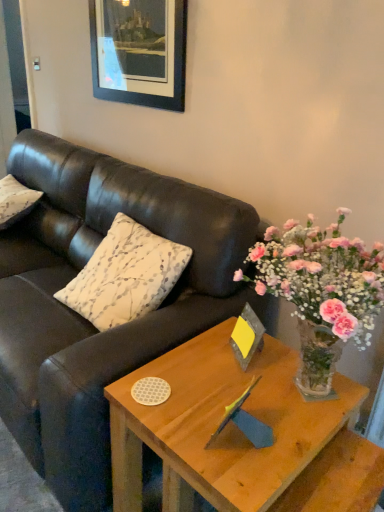
Identify the location of white printed cushion at upper left, which is counted as the first pillow, starting from the front. The width and height of the screenshot is (384, 512). (125, 275).

This screenshot has height=512, width=384. What are the coordinates of `white textured pillow at left, the 2th pillow from the right` in the screenshot? It's located at (15, 201).

What do you see at coordinates (139, 52) in the screenshot? I see `wooden picture frame at upper center, which appears as the second picture frame when ordered from the bottom` at bounding box center [139, 52].

Where is `white printed cushion at upper left, the 1th pillow viewed from the right`? white printed cushion at upper left, the 1th pillow viewed from the right is located at coordinates (125, 275).

Is white printed cushion at upper left, the 2th pillow positioned from the left, not within wooden block with yellow card at center, placed as the 2th picture frame when sorted from top to bottom?

Yes.

Considering the sizes of objects white printed cushion at upper left, the 2th pillow positioned from the left, and wooden block with yellow card at center, the 2th picture frame from the left, in the image provided, who is smaller, white printed cushion at upper left, the 2th pillow positioned from the left, or wooden block with yellow card at center, the 2th picture frame from the left,?

Smaller between the two is wooden block with yellow card at center, the 2th picture frame from the left.

From the image's perspective, is white printed cushion at upper left, placed as the second pillow when sorted from back to front, under wooden block with yellow card at center, placed as the 2th picture frame when sorted from top to bottom?

No, from the image's perspective, white printed cushion at upper left, placed as the second pillow when sorted from back to front, is not below wooden block with yellow card at center, placed as the 2th picture frame when sorted from top to bottom.

Does point (166, 254) come closer to viewer compared to point (246, 360)?

That is False.

The height and width of the screenshot is (512, 384). I want to click on picture frame below the matte black couch at center (from the image's perspective), so click(247, 336).

Who is bigger, wooden block with yellow card at center, placed as the 2th picture frame when sorted from top to bottom, or matte black couch at center?

With larger size is matte black couch at center.

In the scene shown: Can you see wooden block with yellow card at center, marked as the first picture frame in a right-to-left arrangement, touching matte black couch at center?

No, wooden block with yellow card at center, marked as the first picture frame in a right-to-left arrangement, is not with matte black couch at center.

From the picture: Would you say wooden block with yellow card at center, the 2th picture frame from the left, is to the left or to the right of matte black couch at center in the picture?

From the image, it's evident that wooden block with yellow card at center, the 2th picture frame from the left, is to the right of matte black couch at center.

Is point (245, 345) closer to viewer compared to point (163, 33)?

That is True.

From a real-world perspective, does wooden block with yellow card at center, the first picture frame in the front-to-back sequence, stand above wooden picture frame at upper center, which is counted as the second picture frame, starting from the front?

Incorrect, from a real-world perspective, wooden block with yellow card at center, the first picture frame in the front-to-back sequence, is lower than wooden picture frame at upper center, which is counted as the second picture frame, starting from the front.

Does wooden block with yellow card at center, the 2th picture frame from the left, turn towards wooden picture frame at upper center, which is the 1th picture frame in top-to-bottom order?

No, wooden block with yellow card at center, the 2th picture frame from the left, does not turn towards wooden picture frame at upper center, which is the 1th picture frame in top-to-bottom order.

This screenshot has width=384, height=512. In order to click on picture frame that is on the left side of wooden block with yellow card at center, placed as the 2th picture frame when sorted from top to bottom in this screenshot , I will do `click(139, 52)`.

Which of these two, light brown wood coffee table at center or white textured pillow at left, the first pillow positioned from the back, stands shorter?

white textured pillow at left, the first pillow positioned from the back.

Considering the relative sizes of light brown wood coffee table at center and white textured pillow at left, positioned as the first pillow in left-to-right order, in the image provided, is light brown wood coffee table at center wider than white textured pillow at left, positioned as the first pillow in left-to-right order,?

Indeed, light brown wood coffee table at center has a greater width compared to white textured pillow at left, positioned as the first pillow in left-to-right order.

Find the location of `coffee table below the white textured pillow at left, placed as the 2th pillow when sorted from front to back (from a real-world perspective)`. coffee table below the white textured pillow at left, placed as the 2th pillow when sorted from front to back (from a real-world perspective) is located at coordinates (225, 426).

Between white textured pillow at left, placed as the 2th pillow when sorted from front to back, and white printed cushion at upper left, placed as the second pillow when sorted from back to front, which one has smaller width?

With smaller width is white textured pillow at left, placed as the 2th pillow when sorted from front to back.

From a real-world perspective, does white textured pillow at left, positioned as the first pillow in left-to-right order, stand above white printed cushion at upper left, placed as the second pillow when sorted from back to front?

No, from a real-world perspective, white textured pillow at left, positioned as the first pillow in left-to-right order, is not above white printed cushion at upper left, placed as the second pillow when sorted from back to front.

Is white textured pillow at left, positioned as the first pillow in left-to-right order, taller or shorter than white printed cushion at upper left, the 1th pillow viewed from the right?

white textured pillow at left, positioned as the first pillow in left-to-right order, is shorter than white printed cushion at upper left, the 1th pillow viewed from the right.

Is white textured pillow at left, the first pillow positioned from the back, bigger or smaller than white printed cushion at upper left, which is counted as the first pillow, starting from the front?

Considering their sizes, white textured pillow at left, the first pillow positioned from the back, takes up less space than white printed cushion at upper left, which is counted as the first pillow, starting from the front.

Would you say light brown wood coffee table at center is a long distance from white printed cushion at upper left, which is counted as the first pillow, starting from the front?

No, light brown wood coffee table at center is not far from white printed cushion at upper left, which is counted as the first pillow, starting from the front.

Considering the positions of objects light brown wood coffee table at center and white printed cushion at upper left, the 1th pillow viewed from the right, in the image provided, who is more to the left, light brown wood coffee table at center or white printed cushion at upper left, the 1th pillow viewed from the right,?

white printed cushion at upper left, the 1th pillow viewed from the right.

Can you tell me how much light brown wood coffee table at center and white printed cushion at upper left, placed as the second pillow when sorted from back to front, differ in facing direction?

The angle between the facing direction of light brown wood coffee table at center and the facing direction of white printed cushion at upper left, placed as the second pillow when sorted from back to front, is 0.923 degrees.

Based on the photo, who is taller, wooden block with yellow card at center, marked as the first picture frame in a right-to-left arrangement, or white printed cushion at upper left, the 2th pillow positioned from the left?

With more height is white printed cushion at upper left, the 2th pillow positioned from the left.

Identify the location of the 1st pillow behind the wooden block with yellow card at center, positioned as the first picture frame in bottom-to-top order. This screenshot has height=512, width=384. (125, 275).

Looking at this image, which is more to the right, wooden block with yellow card at center, the 2th picture frame from the left, or white printed cushion at upper left, placed as the second pillow when sorted from back to front?

Positioned to the right is wooden block with yellow card at center, the 2th picture frame from the left.

Find the location of `pillow above the wooden block with yellow card at center, marked as the second picture frame in a back-to-front arrangement (from a real-world perspective)`. pillow above the wooden block with yellow card at center, marked as the second picture frame in a back-to-front arrangement (from a real-world perspective) is located at coordinates (125, 275).

This screenshot has width=384, height=512. I want to click on the 1st picture frame behind the matte black couch at center, so click(x=247, y=336).

Based on their spatial positions, is white printed cushion at upper left, the 2th pillow positioned from the left, or light brown wood coffee table at center closer to wooden picture frame at upper center, which is counted as the second picture frame, starting from the front?

white printed cushion at upper left, the 2th pillow positioned from the left.

In the scene shown: Considering their positions, is wooden picture frame at upper center, the 2th picture frame viewed from the right, positioned closer to matte black couch at center than light brown wood coffee table at center?

Among the two, light brown wood coffee table at center is located nearer to matte black couch at center.

From the image, which object appears to be farther from light brown wood coffee table at center, white textured pillow at left, the 2th pillow from the right, or matte black couch at center?

Based on the image, white textured pillow at left, the 2th pillow from the right, appears to be further to light brown wood coffee table at center.

Based on the photo, estimate the real-world distances between objects in this image. Which object is further from matte black couch at center, wooden picture frame at upper center, which is counted as the 1th picture frame, starting from the left, or white textured pillow at left, the first pillow positioned from the back?

wooden picture frame at upper center, which is counted as the 1th picture frame, starting from the left.

Which object lies further to the anchor point matte black couch at center, white printed cushion at upper left, the 1th pillow viewed from the right, or wooden picture frame at upper center, which is counted as the 1th picture frame, starting from the left?

wooden picture frame at upper center, which is counted as the 1th picture frame, starting from the left, is further to matte black couch at center.

When comparing their distances from light brown wood coffee table at center, does wooden block with yellow card at center, the first picture frame in the front-to-back sequence, or white printed cushion at upper left, the 1th pillow viewed from the right, seem further?

white printed cushion at upper left, the 1th pillow viewed from the right, is further to light brown wood coffee table at center.

When comparing their distances from matte black couch at center, does wooden block with yellow card at center, placed as the 2th picture frame when sorted from top to bottom, or white printed cushion at upper left, the 1th pillow viewed from the right, seem further?

wooden block with yellow card at center, placed as the 2th picture frame when sorted from top to bottom, is further to matte black couch at center.

Estimate the real-world distances between objects in this image. Which object is further from wooden picture frame at upper center, the 1th picture frame in the back-to-front sequence, white textured pillow at left, positioned as the first pillow in left-to-right order, or white printed cushion at upper left, the 2th pillow positioned from the left?

Among the two, white textured pillow at left, positioned as the first pillow in left-to-right order, is located further to wooden picture frame at upper center, the 1th picture frame in the back-to-front sequence.

You are a GUI agent. You are given a task and a screenshot of the screen. Output one action in this format:
    pyautogui.click(x=<x>, y=<y>)
    Task: Click on the pillow between matte black couch at center and light brown wood coffee table at center in the horizontal direction
    The width and height of the screenshot is (384, 512).
    Given the screenshot: What is the action you would take?
    pyautogui.click(x=125, y=275)

Image resolution: width=384 pixels, height=512 pixels. I want to click on studio couch between light brown wood coffee table at center and white textured pillow at left, the first pillow positioned from the back, in the front-back direction, so click(x=86, y=320).

You are a GUI agent. You are given a task and a screenshot of the screen. Output one action in this format:
    pyautogui.click(x=<x>, y=<y>)
    Task: Click on the studio couch between wooden picture frame at upper center, which is the 1th picture frame in top-to-bottom order, and white printed cushion at upper left, which is counted as the first pillow, starting from the front, from top to bottom
    This screenshot has height=512, width=384.
    Given the screenshot: What is the action you would take?
    pyautogui.click(x=86, y=320)

You are a GUI agent. You are given a task and a screenshot of the screen. Output one action in this format:
    pyautogui.click(x=<x>, y=<y>)
    Task: Click on the pillow between wooden picture frame at upper center, the 2th picture frame viewed from the right, and white printed cushion at upper left, the 1th pillow viewed from the right, in the vertical direction
    
    Given the screenshot: What is the action you would take?
    pyautogui.click(x=15, y=201)